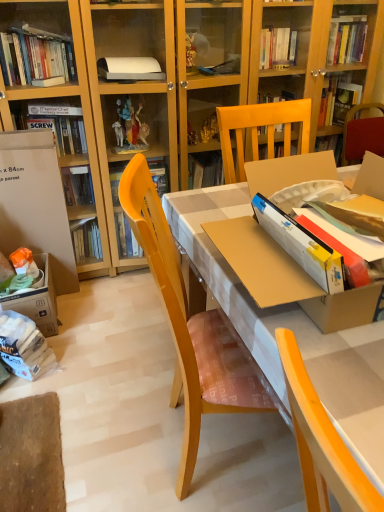
Question: Is matte yellow desk at center positioned far away from white paper bag at lower left?

Choices:
 (A) no
 (B) yes

Answer: (A)

Question: Can you confirm if matte yellow desk at center is smaller than white paper bag at lower left?

Choices:
 (A) yes
 (B) no

Answer: (B)

Question: Can white paper bag at lower left be found inside matte yellow desk at center?

Choices:
 (A) no
 (B) yes

Answer: (A)

Question: Can you confirm if matte yellow desk at center is bigger than white paper bag at lower left?

Choices:
 (A) no
 (B) yes

Answer: (B)

Question: Is matte yellow desk at center placed right next to white paper bag at lower left?

Choices:
 (A) no
 (B) yes

Answer: (A)

Question: Is white cardboard box at left inside or outside of white paper bag at lower left?

Choices:
 (A) inside
 (B) outside

Answer: (B)

Question: Based on their sizes in the image, would you say white cardboard box at left is bigger or smaller than white paper bag at lower left?

Choices:
 (A) small
 (B) big

Answer: (B)

Question: From the image's perspective, is white cardboard box at left above or below white paper bag at lower left?

Choices:
 (A) above
 (B) below

Answer: (A)

Question: Would you say white cardboard box at left is to the left or to the right of white paper bag at lower left in the picture?

Choices:
 (A) right
 (B) left

Answer: (B)

Question: Considering the positions of matte yellow desk at center and white paper bag at lower left in the image, is matte yellow desk at center bigger or smaller than white paper bag at lower left?

Choices:
 (A) big
 (B) small

Answer: (A)

Question: Considering the positions of matte yellow desk at center and white paper bag at lower left in the image, is matte yellow desk at center wider or thinner than white paper bag at lower left?

Choices:
 (A) wide
 (B) thin

Answer: (A)

Question: Considering the positions of point (221, 258) and point (39, 367), is point (221, 258) closer or farther from the camera than point (39, 367)?

Choices:
 (A) closer
 (B) farther

Answer: (A)

Question: Visually, is matte yellow desk at center positioned to the left or to the right of white paper bag at lower left?

Choices:
 (A) right
 (B) left

Answer: (A)

Question: Is white cardboard box at left to the left or to the right of matte yellow desk at center in the image?

Choices:
 (A) left
 (B) right

Answer: (A)

Question: From the image's perspective, is white cardboard box at left positioned above or below matte yellow desk at center?

Choices:
 (A) below
 (B) above

Answer: (B)